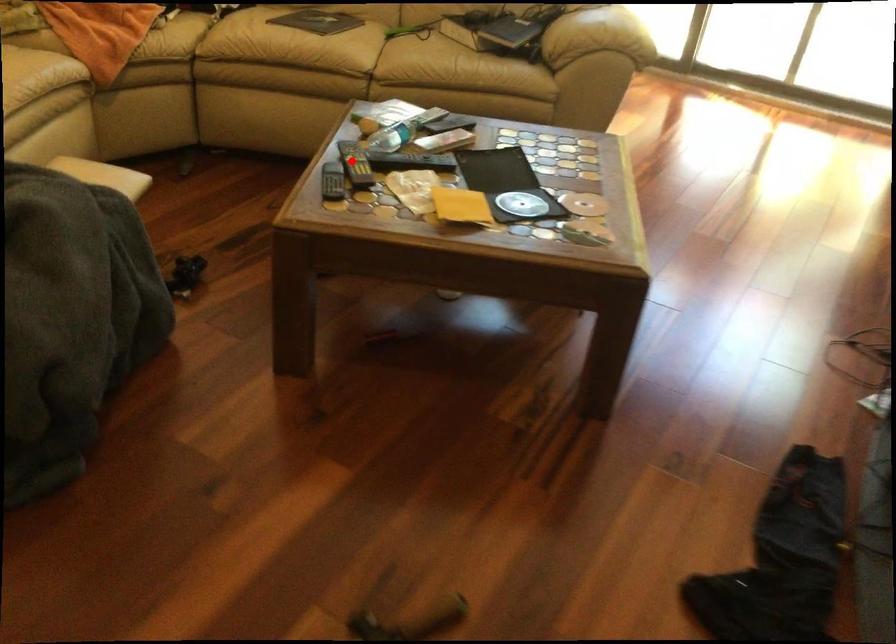
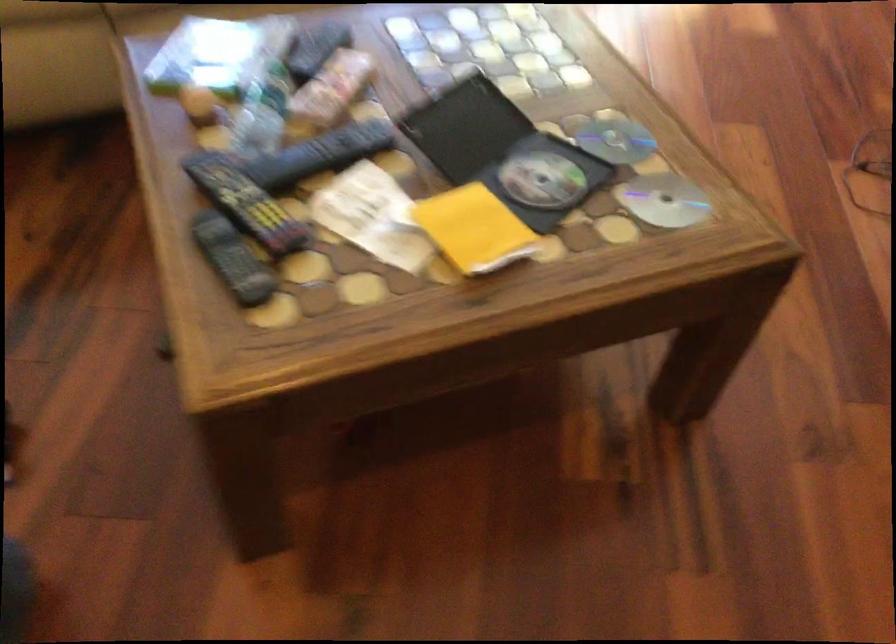
Question: I am providing you with two images of the same scene from different viewpoints. Given a red point in image1, look at the same physical point in image2. Is it:

Choices:
 (A) Closer to the viewpoint
 (B) Farther from the viewpoint

Answer: (A)